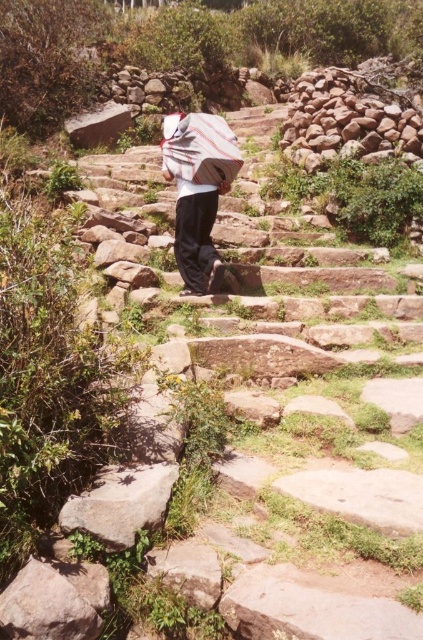
Is smooth stone wall at upper right taller than white striped shirt at center?

Correct, smooth stone wall at upper right is much taller as white striped shirt at center.

Is smooth stone wall at upper right to the right of white striped shirt at center from the viewer's perspective?

Correct, you'll find smooth stone wall at upper right to the right of white striped shirt at center.

Is point (353, 129) closer to viewer compared to point (236, 141)?

No, it is behind (236, 141).

At what (x,y) coordinates should I click in order to perform the action: click on smooth stone wall at upper right. Please return your answer as a coordinate pair (x, y). Looking at the image, I should click on (346, 118).

Between white striped shirt at center and gray rough rock at lower left, which one has more height?

white striped shirt at center is taller.

Between white striped shirt at center and gray rough rock at lower left, which one has less height?

With less height is gray rough rock at lower left.

Is point (195, 262) closer to viewer compared to point (99, 477)?

No, it is not.

Where is `white striped shirt at center`? This screenshot has width=423, height=640. white striped shirt at center is located at coordinates (198, 192).

Can you confirm if gray rough rock at lower left is smaller than white striped fabric umbrella at center?

Yes.

Who is positioned more to the right, gray rough rock at lower left or white striped fabric umbrella at center?

From the viewer's perspective, white striped fabric umbrella at center appears more on the right side.

Image resolution: width=423 pixels, height=640 pixels. In order to click on gray rough rock at lower left in this screenshot , I will do `click(120, 502)`.